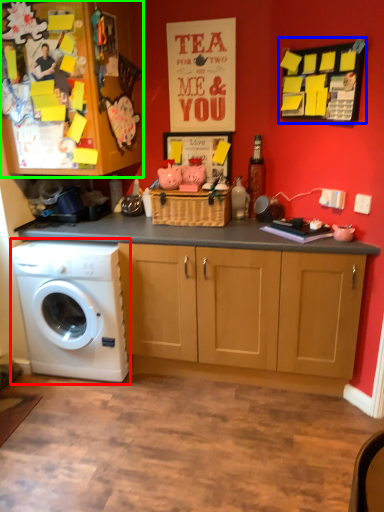
Question: Which object is positioned farthest from washing machine (highlighted by a red box)? Select from bulletin board (highlighted by a blue box) and cabinetry (highlighted by a green box).

Choices:
 (A) bulletin board
 (B) cabinetry

Answer: (A)